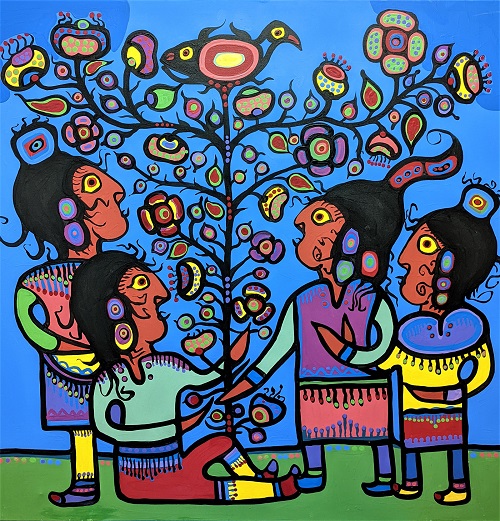
Find the location of a particular element. This screenshot has height=521, width=500. lower left corner of artwork is located at coordinates (0, 517).